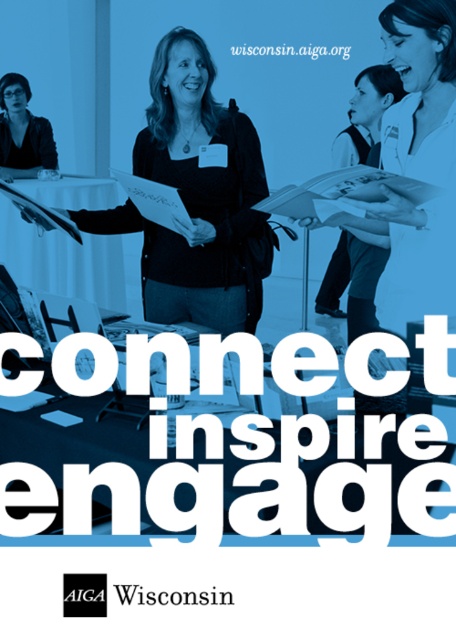
You are designing a poster for AIGA Wisconsin and need to ensure proper placement of elements. According to the scene, where should the matte black jacket at upper left be positioned relative to the white paper at upper center?

The matte black jacket at upper left should be placed below the white paper at upper center as it is located below it in the scene.

You are an event planner organizing a networking event for AIGA Wisconsin. You need to place a 1.2 meter tall banner between the matte black sweater at center and the matte black jacket at upper left. Can the banner fit vertically between them?

The matte black sweater at center is taller than the matte black jacket at upper left. Since the banner is 1.2 meters tall, it can fit vertically between them as long as the vertical space between the two objects accommodates the banner height. However, the exact placement depends on the actual distance between them in the image.

You are organizing a networking event and want to ensure attendees can comfortably interact. Given the distance between the matte black sweater at center and the matte black jacket at upper left, can a person of average height stand between them without feeling cramped?

The matte black sweater at center and the matte black jacket at upper left are 7.65 feet apart from each other. A person of average height typically has a height of around 5.5 feet, so the distance between them is more than sufficient for comfortable interaction. The space allows for easy movement and conversation without feeling cramped.